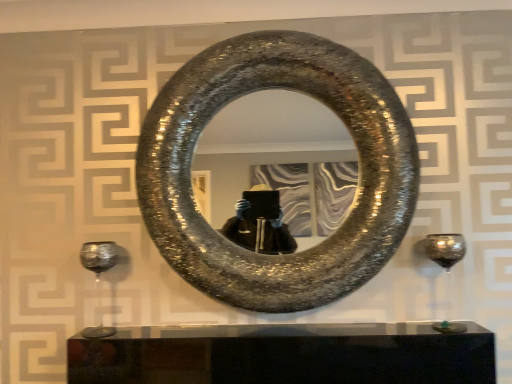
Question: From the image's perspective, relative to transparent glass wine glass at right, acting as the first wine glass starting from the right, is shiny metallic horseshoe at center above or below?

Choices:
 (A) below
 (B) above

Answer: (B)

Question: Is shiny metallic horseshoe at center taller or shorter than transparent glass wine glass at right, acting as the first wine glass starting from the right?

Choices:
 (A) short
 (B) tall

Answer: (B)

Question: Estimate the real-world distances between objects in this image. Which object is farther from the transparent glass wine glass at right, the second wine glass positioned from the left?

Choices:
 (A) shiny metallic horseshoe at center
 (B) shiny metallic wine glass at lower left, the 1th wine glass from the left

Answer: (B)

Question: Which object is positioned farthest from the transparent glass wine glass at right, acting as the first wine glass starting from the right?

Choices:
 (A) shiny metallic horseshoe at center
 (B) shiny metallic wine glass at lower left, which is the second wine glass from right to left

Answer: (B)